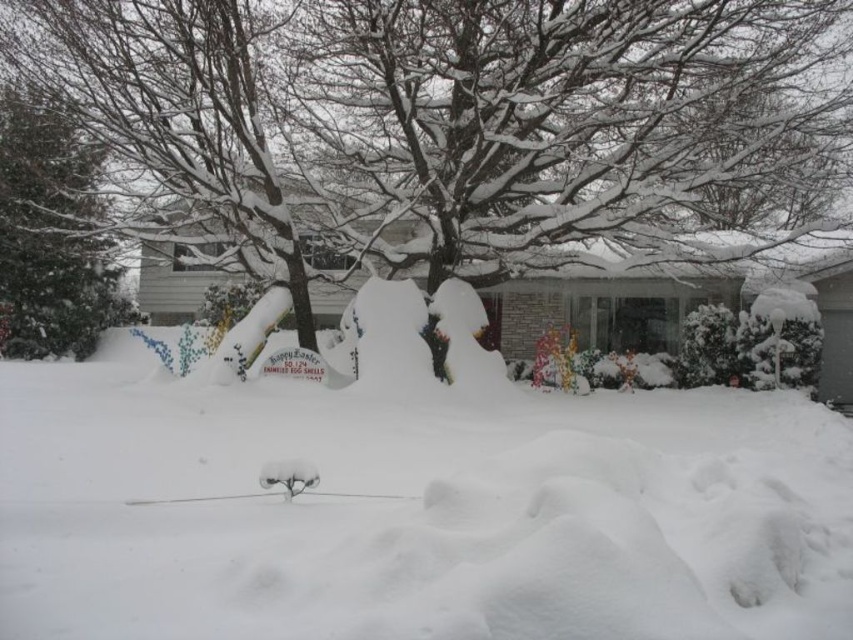
Between point (36, 531) and point (286, 138), which one is positioned behind?

The point (286, 138) is more distant.

How distant is white fluffy snow at center from white snow-covered tree at center?

white fluffy snow at center is 5.62 meters from white snow-covered tree at center.

The height and width of the screenshot is (640, 853). I want to click on white fluffy snow at center, so click(x=416, y=513).

Who is positioned more to the right, white snow-covered tree at center or green leafy tree at left?

white snow-covered tree at center is more to the right.

Locate an element on the screen. The width and height of the screenshot is (853, 640). white snow-covered tree at center is located at coordinates (460, 122).

Image resolution: width=853 pixels, height=640 pixels. Identify the location of white snow-covered tree at center. (460, 122).

Describe the element at coordinates (416, 513) in the screenshot. The image size is (853, 640). I see `white fluffy snow at center` at that location.

You are a GUI agent. You are given a task and a screenshot of the screen. Output one action in this format:
    pyautogui.click(x=<x>, y=<y>)
    Task: Click on the white fluffy snow at center
    
    Given the screenshot: What is the action you would take?
    pyautogui.click(x=416, y=513)